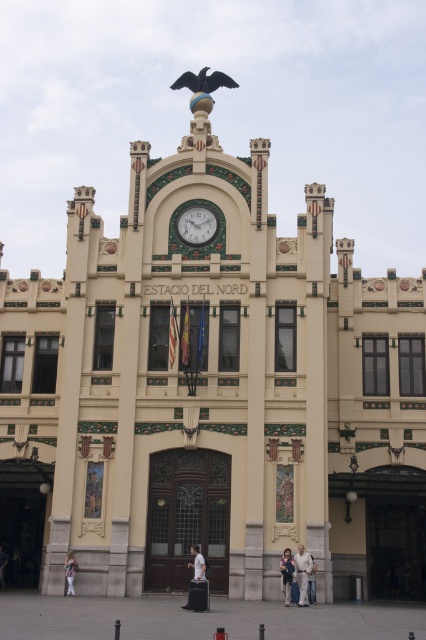
Question: Estimate the real-world distances between objects in this image. Which object is closer to the light beige pants at center?

Choices:
 (A) shiny black eagle at upper center
 (B) white fabric person at lower left
 (C) light beige pants at lower left

Answer: (C)

Question: Is white matte statue at center further to camera compared to white cotton shirt at center?

Choices:
 (A) yes
 (B) no

Answer: (B)

Question: Among these objects, which one is farthest from the camera?

Choices:
 (A) white cotton shirt at center
 (B) green textured clock at center
 (C) light beige pants at center
 (D) shiny black eagle at upper center

Answer: (D)

Question: Observing the image, what is the correct spatial positioning of green textured clock at center in reference to dark blue jeans at lower center?

Choices:
 (A) left
 (B) right

Answer: (A)

Question: Is light beige pants at lower left closer to camera compared to white fabric person at lower left?

Choices:
 (A) no
 (B) yes

Answer: (B)

Question: Which point is closer to the camera?

Choices:
 (A) white matte statue at center
 (B) dark blue jeans at lower center

Answer: (A)